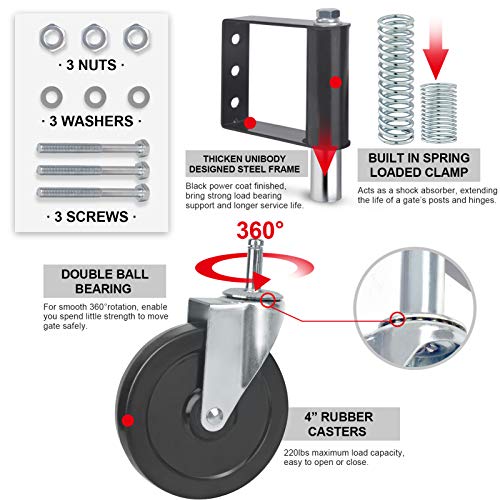
Locate an element on the screen. "4 " rubber casters" is located at coordinates (347, 423).